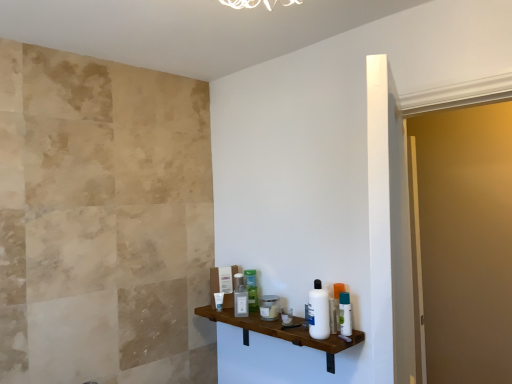
Question: Is white glossy lotion at center, positioned as the sixth toiletry in right-to-left order, shorter than white plastic bottle at shelf, the 6th toiletry when ordered from left to right?

Choices:
 (A) no
 (B) yes

Answer: (B)

Question: Is white plastic bottle at shelf, the second toiletry in the right-to-left sequence, inside white glossy lotion at center, the 3th toiletry in the back-to-front sequence?

Choices:
 (A) no
 (B) yes

Answer: (A)

Question: Is there a large distance between white glossy lotion at center, positioned as the sixth toiletry in right-to-left order, and white plastic bottle at shelf, the second toiletry in the right-to-left sequence?

Choices:
 (A) yes
 (B) no

Answer: (B)

Question: Does white glossy lotion at center, which appears as the fifth toiletry when viewed from the front, come behind white plastic bottle at shelf, the first toiletry viewed from the front?

Choices:
 (A) no
 (B) yes

Answer: (B)

Question: Can we say white glossy lotion at center, which appears as the fifth toiletry when viewed from the front, lies outside white plastic bottle at shelf, which appears as the seventh toiletry when viewed from the back?

Choices:
 (A) yes
 (B) no

Answer: (A)

Question: Is white glossy lotion at center, positioned as the sixth toiletry in right-to-left order, to the left of white plastic bottle at shelf, which appears as the seventh toiletry when viewed from the back, from the viewer's perspective?

Choices:
 (A) yes
 (B) no

Answer: (A)

Question: Can you confirm if white plastic bottle at shelf, the second toiletry in the right-to-left sequence, is shorter than white glossy tube at center, the seventh toiletry positioned from the right?

Choices:
 (A) no
 (B) yes

Answer: (A)

Question: Does white plastic bottle at shelf, the first toiletry viewed from the front, lie behind white glossy tube at center, which is counted as the first toiletry, starting from the back?

Choices:
 (A) yes
 (B) no

Answer: (B)

Question: Could you tell me if white plastic bottle at shelf, the 6th toiletry when ordered from left to right, is facing white glossy tube at center, the 1th toiletry in the left-to-right sequence?

Choices:
 (A) no
 (B) yes

Answer: (A)

Question: Is white plastic bottle at shelf, which appears as the seventh toiletry when viewed from the back, smaller than white glossy tube at center, the seventh toiletry positioned from the right?

Choices:
 (A) yes
 (B) no

Answer: (B)

Question: Is white plastic bottle at shelf, the second toiletry in the right-to-left sequence, positioned with its back to white glossy tube at center, which is counted as the first toiletry, starting from the back?

Choices:
 (A) no
 (B) yes

Answer: (A)

Question: From the image's perspective, does white plastic bottle at shelf, which appears as the seventh toiletry when viewed from the back, appear lower than white glossy tube at center, the seventh toiletry positioned from the right?

Choices:
 (A) no
 (B) yes

Answer: (A)

Question: From the image's perspective, is white glossy lotion at center, the 3th toiletry in the back-to-front sequence, located beneath matte glass jar at center, the 4th toiletry when ordered from back to front?

Choices:
 (A) yes
 (B) no

Answer: (B)